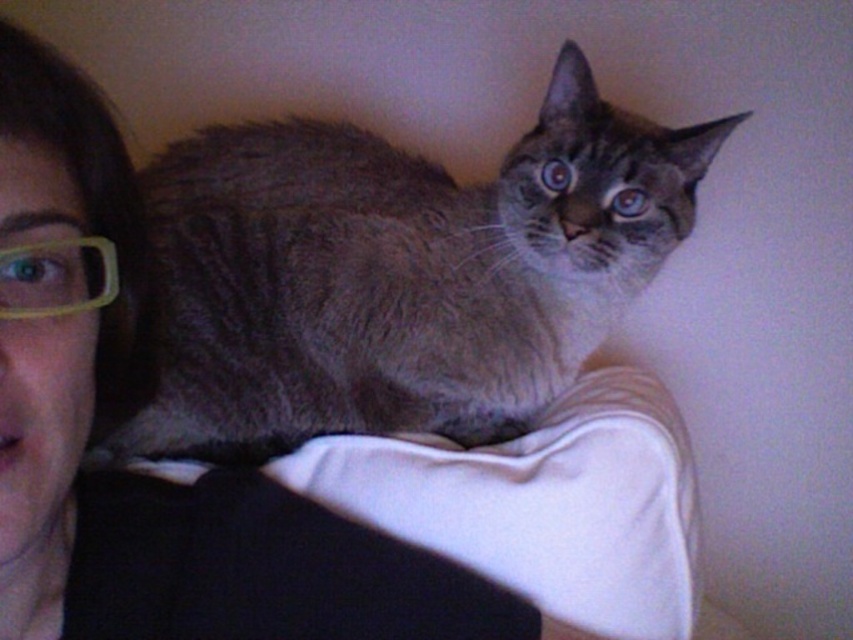
Question: Among these points, which one is nearest to the camera?

Choices:
 (A) (7, 308)
 (B) (490, 198)

Answer: (A)

Question: Observing the image, what is the correct spatial positioning of gray fur cat at center in reference to yellow plastic glasses at left?

Choices:
 (A) above
 (B) below

Answer: (A)

Question: Which point is closer to the camera taking this photo?

Choices:
 (A) 350,320
 (B) 16,262

Answer: (B)

Question: Where is gray fur cat at center located in relation to yellow plastic glasses at left in the image?

Choices:
 (A) above
 (B) below

Answer: (A)

Question: Is gray fur cat at center smaller than yellow plastic glasses at left?

Choices:
 (A) no
 (B) yes

Answer: (A)

Question: Which point is farther to the camera?

Choices:
 (A) gray fur cat at center
 (B) yellow plastic glasses at left

Answer: (A)